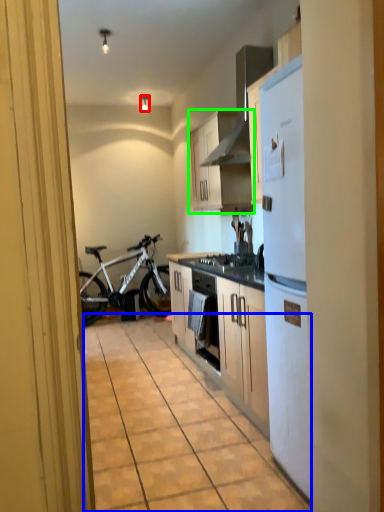
Question: Considering the real-world distances, which object is closest to lamp (highlighted by a red box)? alley (highlighted by a blue box) or cabinetry (highlighted by a green box).

Choices:
 (A) alley
 (B) cabinetry

Answer: (B)